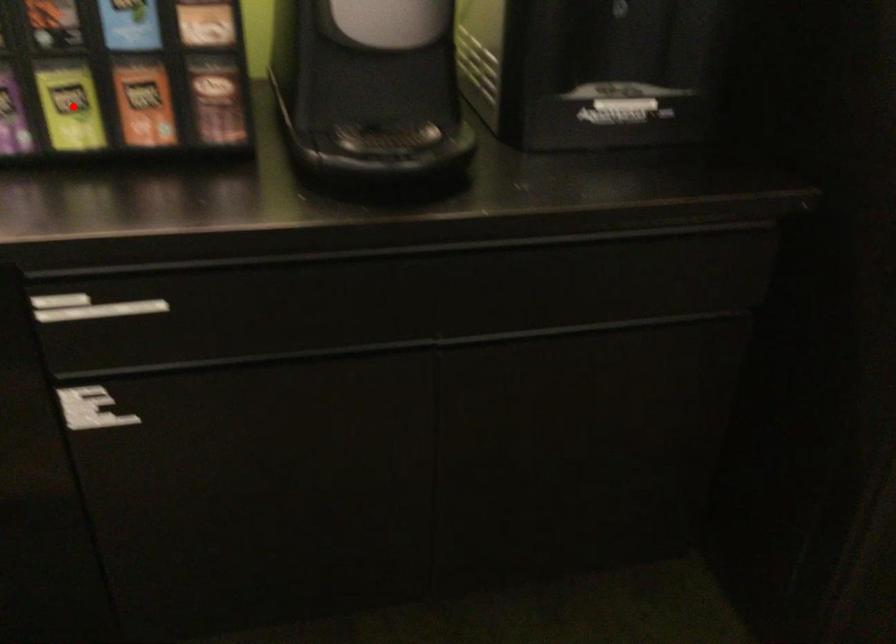
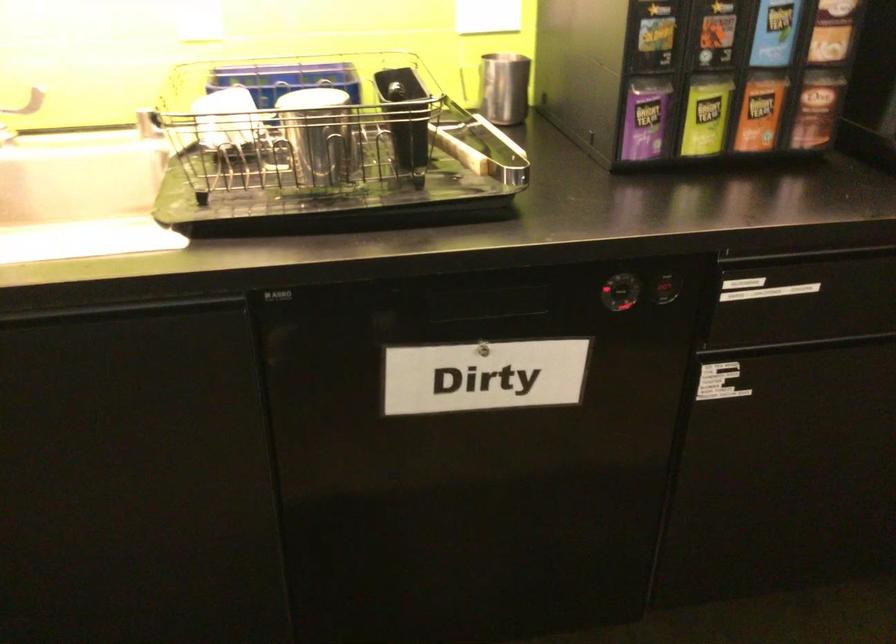
Find the pixel in the second image that matches the highlighted location in the first image.

(705, 116)